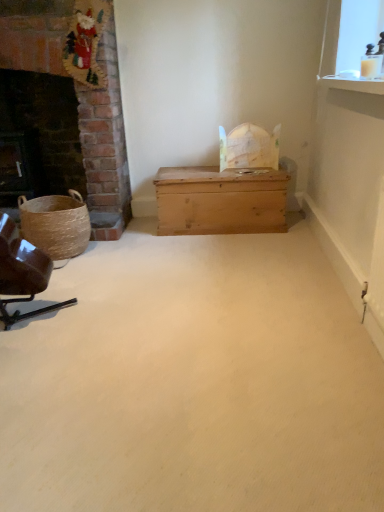
Question: From the image's perspective, would you say dark brick fireplace at left is shown under brown leather chair at left?

Choices:
 (A) yes
 (B) no

Answer: (B)

Question: Is dark brick fireplace at left positioned far away from brown leather chair at left?

Choices:
 (A) yes
 (B) no

Answer: (A)

Question: From a real-world perspective, is dark brick fireplace at left located higher than brown leather chair at left?

Choices:
 (A) yes
 (B) no

Answer: (A)

Question: Could you tell me if dark brick fireplace at left is turned towards brown leather chair at left?

Choices:
 (A) no
 (B) yes

Answer: (A)

Question: Is dark brick fireplace at left taller than brown leather chair at left?

Choices:
 (A) yes
 (B) no

Answer: (A)

Question: In the image, is wooden trunk at center on the left side or the right side of brown leather chair at left?

Choices:
 (A) right
 (B) left

Answer: (A)

Question: From a real-world perspective, is wooden trunk at center physically located above or below brown leather chair at left?

Choices:
 (A) above
 (B) below

Answer: (B)

Question: Do you think wooden trunk at center is within brown leather chair at left, or outside of it?

Choices:
 (A) inside
 (B) outside

Answer: (B)

Question: From their relative heights in the image, would you say wooden trunk at center is taller or shorter than brown leather chair at left?

Choices:
 (A) tall
 (B) short

Answer: (B)

Question: Is dark brick fireplace at left inside the boundaries of woven brown basket at left, or outside?

Choices:
 (A) inside
 (B) outside

Answer: (B)

Question: Is point (1, 106) positioned closer to the camera than point (19, 202)?

Choices:
 (A) farther
 (B) closer

Answer: (A)

Question: From the image's perspective, is dark brick fireplace at left located above or below woven brown basket at left?

Choices:
 (A) above
 (B) below

Answer: (A)

Question: In terms of width, does dark brick fireplace at left look wider or thinner when compared to woven brown basket at left?

Choices:
 (A) thin
 (B) wide

Answer: (A)

Question: In terms of height, does light brown wooden chest at center look taller or shorter compared to wooden trunk at center?

Choices:
 (A) short
 (B) tall

Answer: (B)

Question: Looking at their shapes, would you say light brown wooden chest at center is wider or thinner than wooden trunk at center?

Choices:
 (A) wide
 (B) thin

Answer: (B)